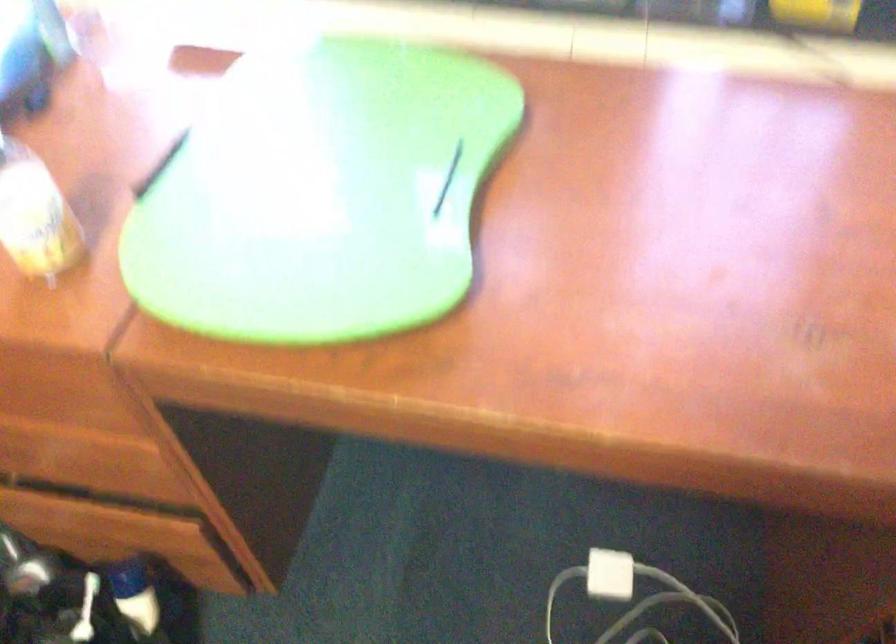
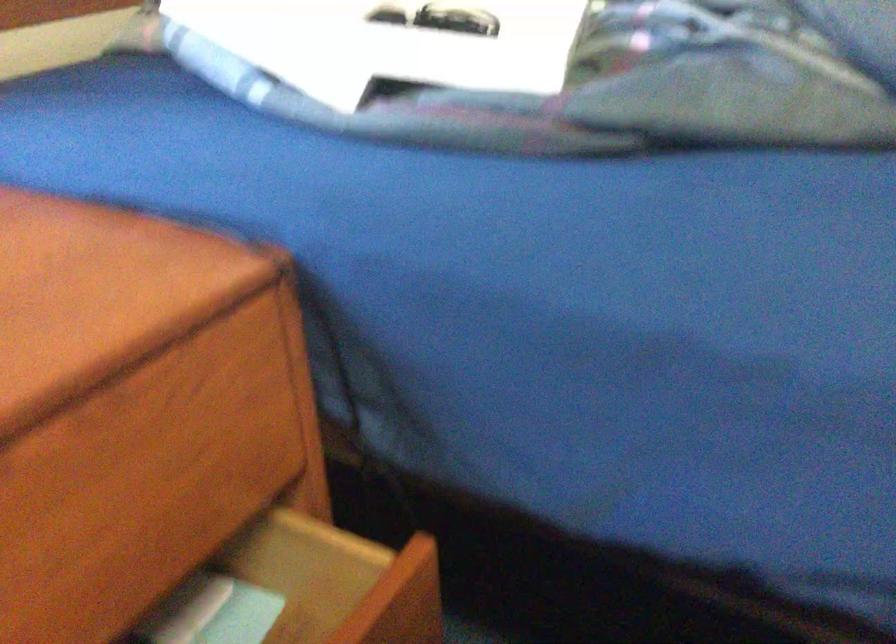
Question: The images are taken continuously from a first-person perspective. In which direction is your viewpoint rotating?

Choices:
 (A) Left
 (B) Right
 (C) Up
 (D) Down

Answer: (B)